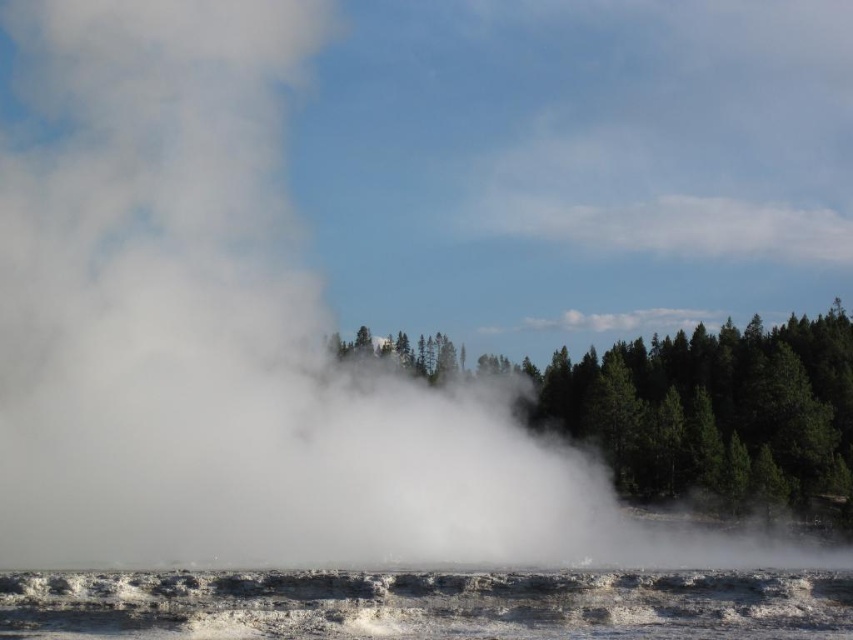
Question: Is white frothy water at lower center smaller than green matte trees at center?

Choices:
 (A) no
 (B) yes

Answer: (B)

Question: Which of the following is the closest to the observer?

Choices:
 (A) (500, 572)
 (B) (825, 419)

Answer: (A)

Question: Which object is farther from the camera taking this photo?

Choices:
 (A) white frothy water at lower center
 (B) green matte trees at center

Answer: (B)

Question: Is white frothy water at lower center to the left of green matte trees at center from the viewer's perspective?

Choices:
 (A) no
 (B) yes

Answer: (B)

Question: Does white frothy water at lower center come behind green matte trees at center?

Choices:
 (A) yes
 (B) no

Answer: (B)